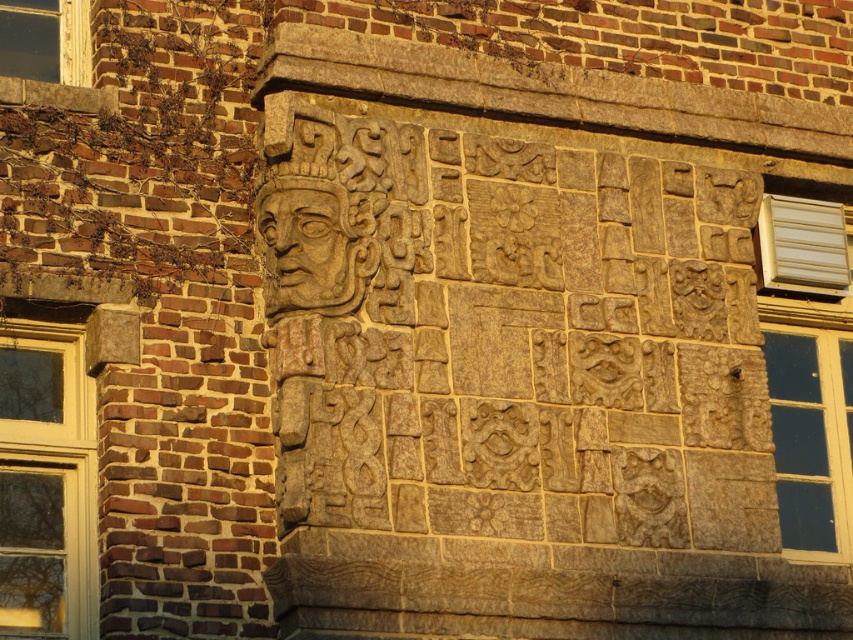
Looking at this image, between white painted wood window at lower left and clear glass window at upper left, which one has less height?

With less height is clear glass window at upper left.

Is white painted wood window at lower left above clear glass window at upper left?

No.

The width and height of the screenshot is (853, 640). I want to click on white painted wood window at lower left, so pos(45,474).

Which is below, carved stone face at upper center or clear glass window at upper left?

carved stone face at upper center

Measure the distance between point (x=334, y=307) and camera.

They are 137.73 feet apart.

In order to click on carved stone face at upper center in this screenshot , I will do `click(305, 252)`.

This screenshot has width=853, height=640. In order to click on carved stone face at upper center in this screenshot , I will do click(x=305, y=252).

The image size is (853, 640). What do you see at coordinates (809, 371) in the screenshot?
I see `white plastic air conditioner at right` at bounding box center [809, 371].

In the scene shown: Who is lower down, white plastic air conditioner at right or clear glass window at upper left?

Answer: Positioned lower is white plastic air conditioner at right.

The height and width of the screenshot is (640, 853). Find the location of `white plastic air conditioner at right`. white plastic air conditioner at right is located at coordinates (809, 371).

What are the coordinates of `white plastic air conditioner at right` in the screenshot? It's located at (809, 371).